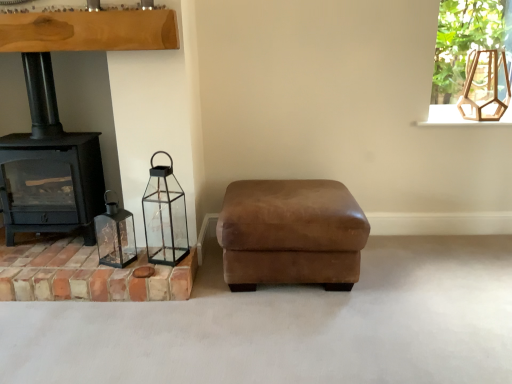
Question: From the image's perspective, is clear glass frame at upper right located above or below matte glass lantern at left, the 1th candle holder when ordered from left to right?

Choices:
 (A) below
 (B) above

Answer: (B)

Question: Looking at their shapes, would you say clear glass frame at upper right is wider or thinner than matte glass lantern at left, arranged as the second candle holder when viewed from the right?

Choices:
 (A) thin
 (B) wide

Answer: (B)

Question: Estimate the real-world distances between objects in this image. Which object is closer to the matte glass lantern at left, arranged as the second candle holder when viewed from the right?

Choices:
 (A) terracotta brick at lower left
 (B) black glass lantern at lower left, the 1th candle holder in the right-to-left sequence
 (C) clear glass frame at upper right
 (D) black cast iron wood burning stove at left
 (E) brown suede ottoman at center

Answer: (A)

Question: Which of these objects is positioned closest to the brown suede ottoman at center?

Choices:
 (A) clear glass frame at upper right
 (B) terracotta brick at lower left
 (C) black cast iron wood burning stove at left
 (D) black glass lantern at lower left, positioned as the 2th candle holder in left-to-right order
 (E) wooden hexagonal lantern at upper right

Answer: (D)